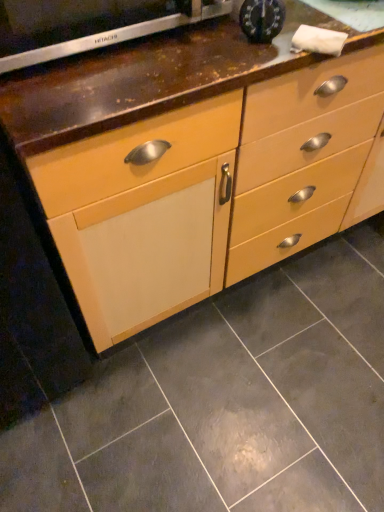
Question: Does matte wood chest of drawers at center have a greater height compared to matte gray tile at center?

Choices:
 (A) yes
 (B) no

Answer: (A)

Question: From the image's perspective, is matte wood chest of drawers at center below matte gray tile at center?

Choices:
 (A) no
 (B) yes

Answer: (A)

Question: Is matte wood chest of drawers at center not inside matte gray tile at center?

Choices:
 (A) no
 (B) yes

Answer: (B)

Question: Is matte wood chest of drawers at center closer to camera compared to matte gray tile at center?

Choices:
 (A) yes
 (B) no

Answer: (A)

Question: Is matte wood chest of drawers at center at the right side of matte gray tile at center?

Choices:
 (A) yes
 (B) no

Answer: (A)

Question: Considering the relative positions of satin silver oven at upper left, marked as the first appliance in a left-to-right arrangement, and matte gray tile at center in the image provided, is satin silver oven at upper left, marked as the first appliance in a left-to-right arrangement, to the left or to the right of matte gray tile at center?

Choices:
 (A) left
 (B) right

Answer: (A)

Question: In terms of width, does satin silver oven at upper left, acting as the 2th appliance starting from the right, look wider or thinner when compared to matte gray tile at center?

Choices:
 (A) thin
 (B) wide

Answer: (A)

Question: From the image's perspective, is satin silver oven at upper left, acting as the 2th appliance starting from the right, positioned above or below matte gray tile at center?

Choices:
 (A) below
 (B) above

Answer: (B)

Question: From a real-world perspective, is satin silver oven at upper left, marked as the first appliance in a left-to-right arrangement, physically located above or below matte gray tile at center?

Choices:
 (A) below
 (B) above

Answer: (B)

Question: Looking at the image, does metallic clock at upper center, acting as the second appliance starting from the left, seem bigger or smaller compared to matte wood chest of drawers at center?

Choices:
 (A) small
 (B) big

Answer: (A)

Question: From the image's perspective, is metallic clock at upper center, acting as the second appliance starting from the left, above or below matte wood chest of drawers at center?

Choices:
 (A) above
 (B) below

Answer: (A)

Question: Does point (261, 13) appear closer or farther from the camera than point (92, 102)?

Choices:
 (A) closer
 (B) farther

Answer: (B)

Question: From a real-world perspective, relative to matte wood chest of drawers at center, is metallic clock at upper center, which ranks as the 1th appliance in right-to-left order, vertically above or below?

Choices:
 (A) above
 (B) below

Answer: (A)

Question: Considering the positions of matte gray tile at center and satin silver oven at upper left, marked as the first appliance in a left-to-right arrangement, in the image, is matte gray tile at center wider or thinner than satin silver oven at upper left, marked as the first appliance in a left-to-right arrangement,?

Choices:
 (A) thin
 (B) wide

Answer: (B)

Question: Considering the positions of point (382, 467) and point (77, 44), is point (382, 467) closer or farther from the camera than point (77, 44)?

Choices:
 (A) farther
 (B) closer

Answer: (A)